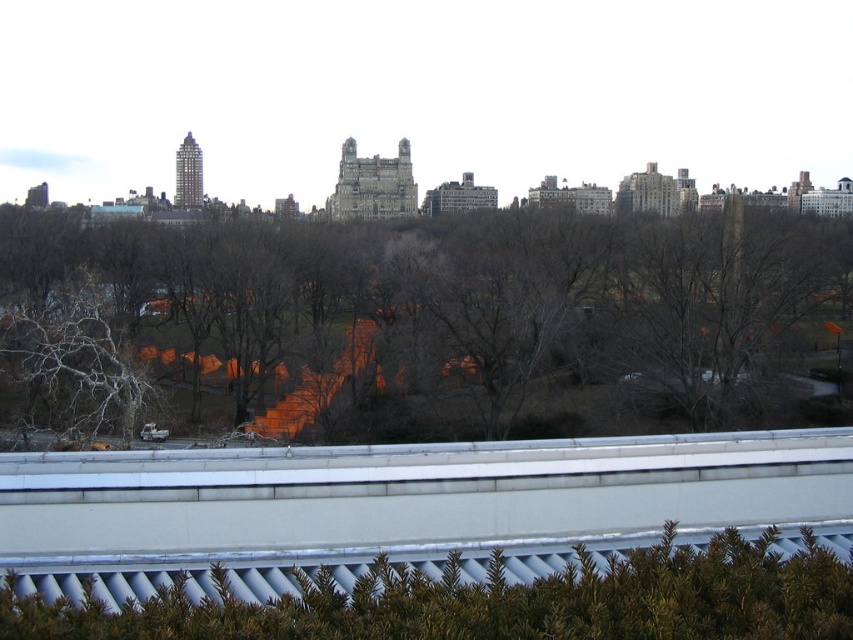
Does brown leafless tree at center have a greater height compared to green textured hedge at lower center?

Yes, brown leafless tree at center is taller than green textured hedge at lower center.

Does brown leafless tree at center have a larger size compared to green textured hedge at lower center?

Correct, brown leafless tree at center is larger in size than green textured hedge at lower center.

Between point (793, 392) and point (27, 595), which one is positioned behind?

The point (793, 392) is behind.

At what (x,y) coordinates should I click in order to perform the action: click on brown leafless tree at center. Please return your answer as a coordinate pair (x, y). This screenshot has width=853, height=640. Looking at the image, I should click on (421, 324).